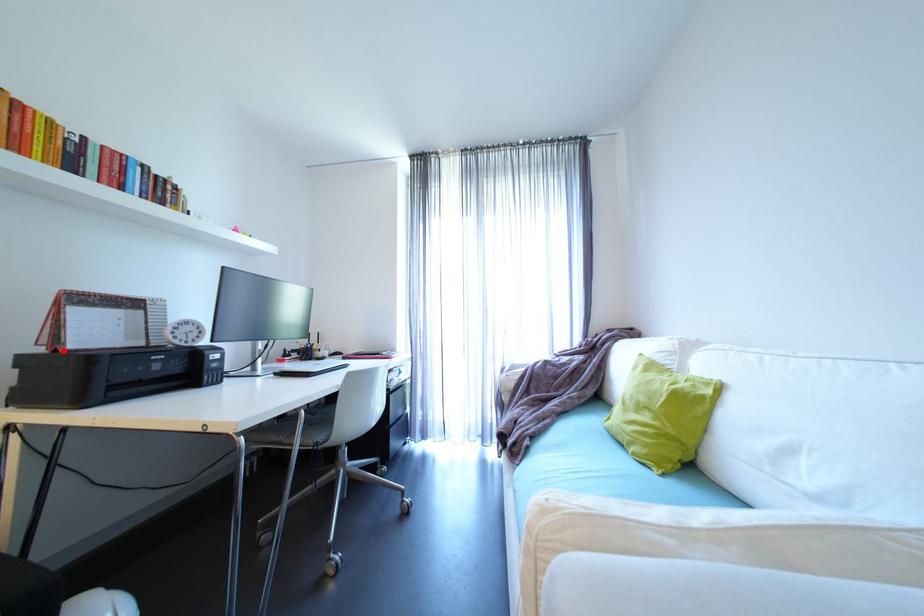
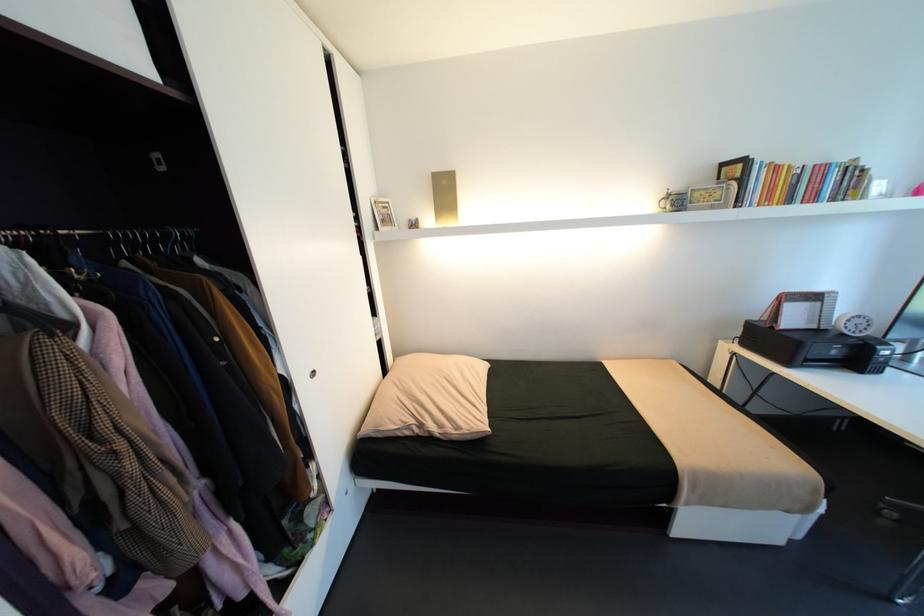
Locate, in the second image, the point that corresponds to the highlighted location in the first image.

(779, 328)